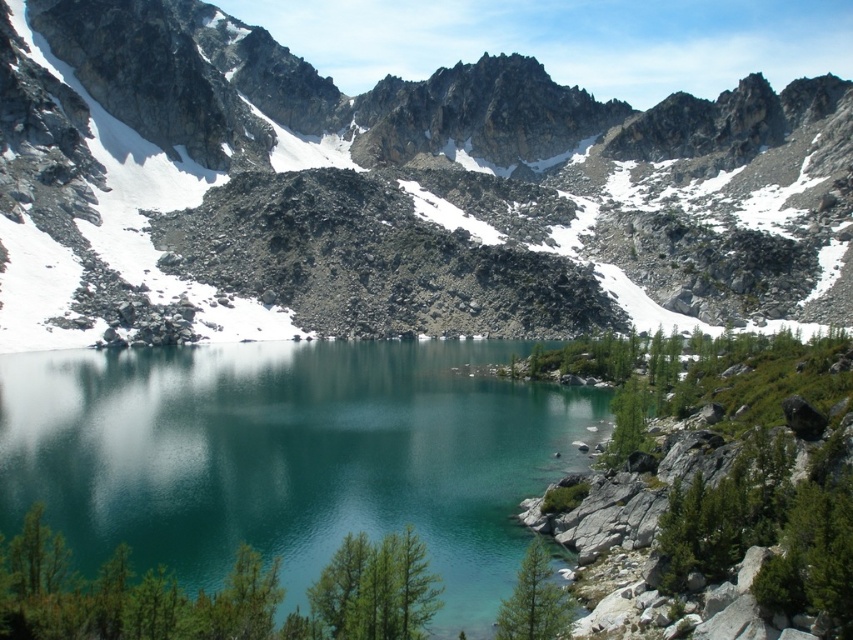
Based on the photo, you are standing at point (437,627) and want to reach point (10,232). Which direction should you move to get closer to your destination?

You should move towards the direction opposite of point (437,627) since point (10,232) is behind point (437,627) from your current position.